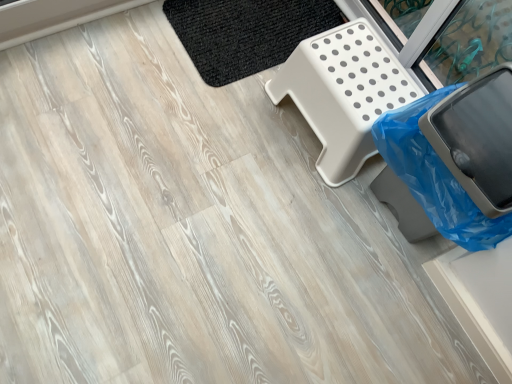
Where is `free space to the left of blue plastic trash can at lower right`? Image resolution: width=512 pixels, height=384 pixels. free space to the left of blue plastic trash can at lower right is located at coordinates (293, 193).